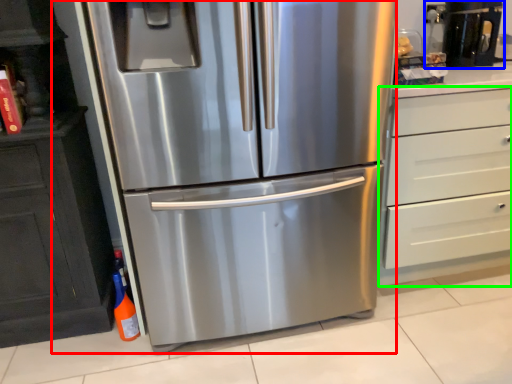
Question: Which is nearer to the refrigerator (highlighted by a red box)? coffee machine (highlighted by a blue box) or chest of drawers (highlighted by a green box).

Choices:
 (A) coffee machine
 (B) chest of drawers

Answer: (B)